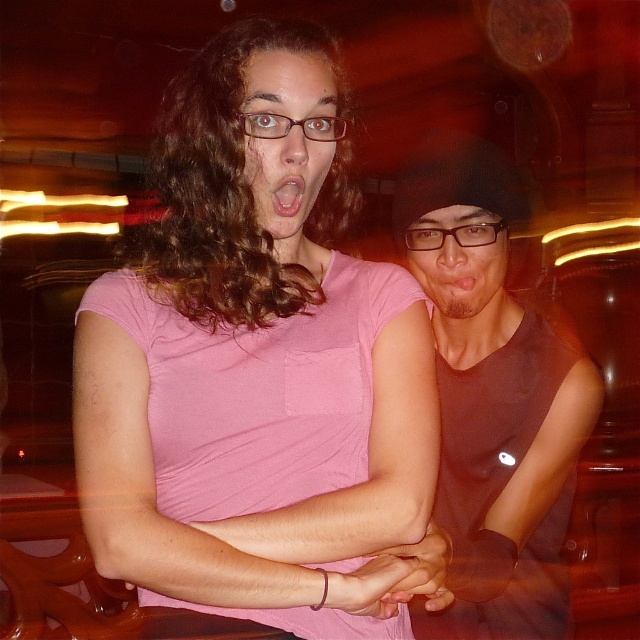
Question: Which object is the closest to the matte pink shirt at center?

Choices:
 (A) pink matte shirt at center
 (B) pink matte mouth at center
 (C) matte black tank top at center
 (D) dry matte lips at center

Answer: (B)

Question: Considering the relative positions of matte black tank top at center and pink matte mouth at center in the image provided, where is matte black tank top at center located with respect to pink matte mouth at center?

Choices:
 (A) left
 (B) right

Answer: (B)

Question: Where is matte black tank top at center located in relation to matte black glasses at center in the image?

Choices:
 (A) below
 (B) above

Answer: (A)

Question: Can you confirm if pink matte shirt at center is positioned below matte pink shirt at center?

Choices:
 (A) yes
 (B) no

Answer: (A)

Question: Which point is closer to the camera taking this photo?

Choices:
 (A) (426, 230)
 (B) (221, 545)

Answer: (B)

Question: Which of the following is the closest to the observer?

Choices:
 (A) (458, 136)
 (B) (228, 417)
 (C) (304, 196)
 (D) (269, 88)

Answer: (B)